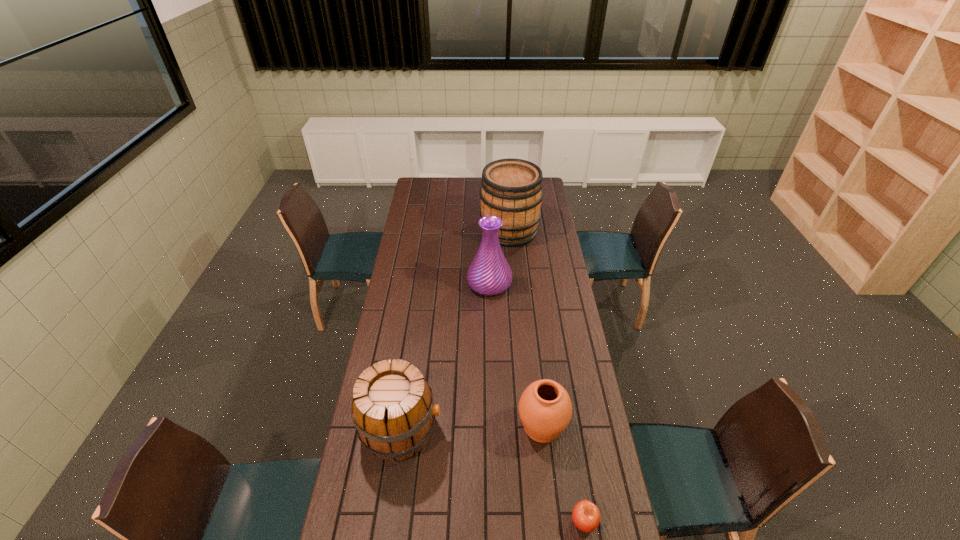
At what (x,y) coordinates should I click in order to perform the action: click on free spot between the apple and the right cider. Please return your answer as a coordinate pair (x, y). Looking at the image, I should click on (546, 376).

The width and height of the screenshot is (960, 540). In order to click on free space between the nearer cider and the urn in this screenshot , I will do `click(471, 428)`.

Where is `free space between the farthest object and the apple`? free space between the farthest object and the apple is located at coordinates tap(546, 376).

You are a GUI agent. You are given a task and a screenshot of the screen. Output one action in this format:
    pyautogui.click(x=<x>, y=<y>)
    Task: Click on the free space between the nearest object and the nearer cider
    
    Given the screenshot: What is the action you would take?
    pyautogui.click(x=492, y=476)

Identify the location of free space between the fourth tallest object and the nearest object. Image resolution: width=960 pixels, height=540 pixels. (563, 474).

Where is `object that can be found as the fourth closest to the second farthest object`? object that can be found as the fourth closest to the second farthest object is located at coordinates (586, 516).

At what (x,y) coordinates should I click in order to perform the action: click on the fourth closest object to the shorter cider. Please return your answer as a coordinate pair (x, y). The width and height of the screenshot is (960, 540). Looking at the image, I should click on (511, 189).

I want to click on vacant space that satisfies the following two spatial constraints: 1. on the front side of the right cider; 2. on the side of the shorter cider where the spigot is located, so click(x=526, y=430).

You are a GUI agent. You are given a task and a screenshot of the screen. Output one action in this format:
    pyautogui.click(x=<x>, y=<y>)
    Task: Click on the vacant region that satisfies the following two spatial constraints: 1. on the front side of the nearest object; 2. on the left side of the second shortest object
    The width and height of the screenshot is (960, 540).
    Given the screenshot: What is the action you would take?
    pyautogui.click(x=553, y=522)

The height and width of the screenshot is (540, 960). I want to click on free region that satisfies the following two spatial constraints: 1. on the back side of the apple; 2. on the side of the third tallest object where the spigot is located, so click(569, 430).